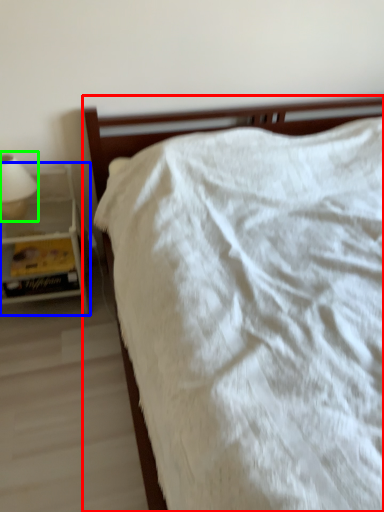
Question: Which object is the closest to the bed (highlighted by a red box)? Choose among these: nightstand (highlighted by a blue box) or bedside lamp (highlighted by a green box).

Choices:
 (A) nightstand
 (B) bedside lamp

Answer: (A)